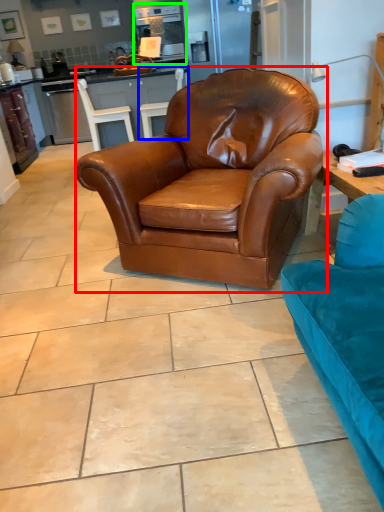
Question: Which object is positioned farthest from chair (highlighted by a red box)? Select from chair (highlighted by a blue box) and appliance (highlighted by a green box).

Choices:
 (A) chair
 (B) appliance

Answer: (B)